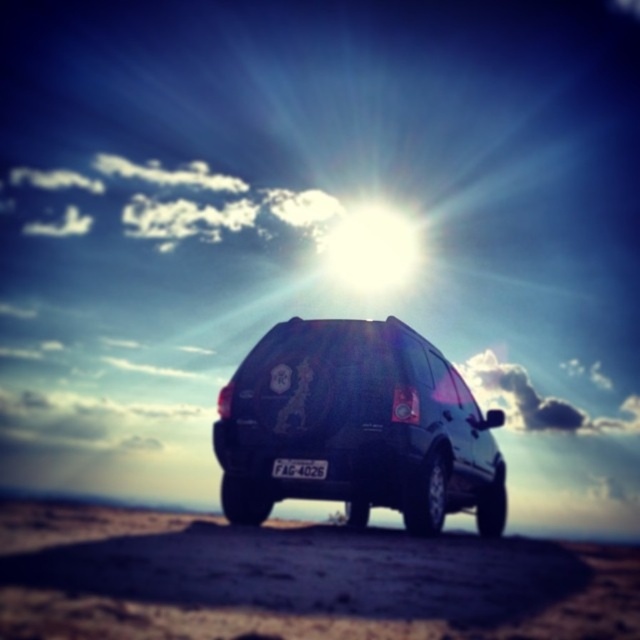
Question: Estimate the real-world distances between objects in this image. Which object is closer to the sandy/dry sand at center?

Choices:
 (A) white plastic license plate at center
 (B) satin black suv at center

Answer: (A)

Question: Which of the following is the farthest from the observer?

Choices:
 (A) sandy/dry sand at center
 (B) white plastic license plate at center
 (C) satin black suv at center

Answer: (B)

Question: Does satin black suv at center appear on the right side of white plastic license plate at center?

Choices:
 (A) no
 (B) yes

Answer: (B)

Question: Based on their relative distances, which object is nearer to the sandy/dry sand at center?

Choices:
 (A) white plastic license plate at center
 (B) satin black suv at center

Answer: (A)

Question: Can you confirm if satin black suv at center is positioned above white plastic license plate at center?

Choices:
 (A) no
 (B) yes

Answer: (A)

Question: Does sandy/dry sand at center appear on the left side of satin black suv at center?

Choices:
 (A) yes
 (B) no

Answer: (A)